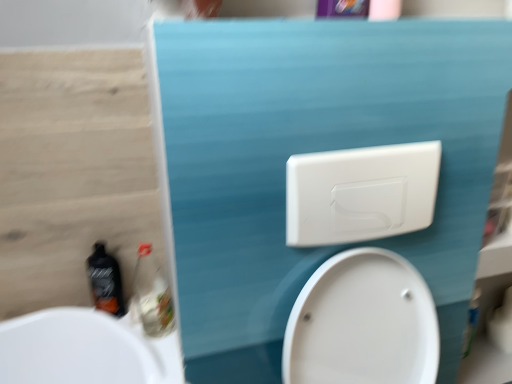
Question: Is white glossy toilet at center with wooden at left?

Choices:
 (A) no
 (B) yes

Answer: (A)

Question: Is wooden at left at the back of white glossy toilet at center?

Choices:
 (A) no
 (B) yes

Answer: (A)

Question: Could you tell me if white glossy toilet at center is turned towards wooden at left?

Choices:
 (A) no
 (B) yes

Answer: (A)

Question: Is white glossy toilet at center at the left side of wooden at left?

Choices:
 (A) no
 (B) yes

Answer: (A)

Question: Is white glossy toilet at center closer to the viewer compared to wooden at left?

Choices:
 (A) no
 (B) yes

Answer: (B)

Question: From a real-world perspective, is white glossy toilet at center over wooden at left?

Choices:
 (A) yes
 (B) no

Answer: (B)

Question: From the image's perspective, would you say wooden at left is shown under white glossy toilet at center?

Choices:
 (A) yes
 (B) no

Answer: (B)

Question: Is white glossy toilet at center completely or partially inside wooden at left?

Choices:
 (A) yes
 (B) no

Answer: (B)

Question: Is wooden at left positioned behind white glossy toilet at center?

Choices:
 (A) yes
 (B) no

Answer: (A)

Question: Does wooden at left have a lesser width compared to white glossy toilet at center?

Choices:
 (A) yes
 (B) no

Answer: (A)

Question: Considering the relative sizes of wooden at left and white glossy toilet at center in the image provided, is wooden at left smaller than white glossy toilet at center?

Choices:
 (A) yes
 (B) no

Answer: (A)

Question: Is wooden at left beside white glossy toilet at center?

Choices:
 (A) yes
 (B) no

Answer: (B)

Question: Are white plastic toilet flush handle at upper center and wooden at left beside each other?

Choices:
 (A) yes
 (B) no

Answer: (B)